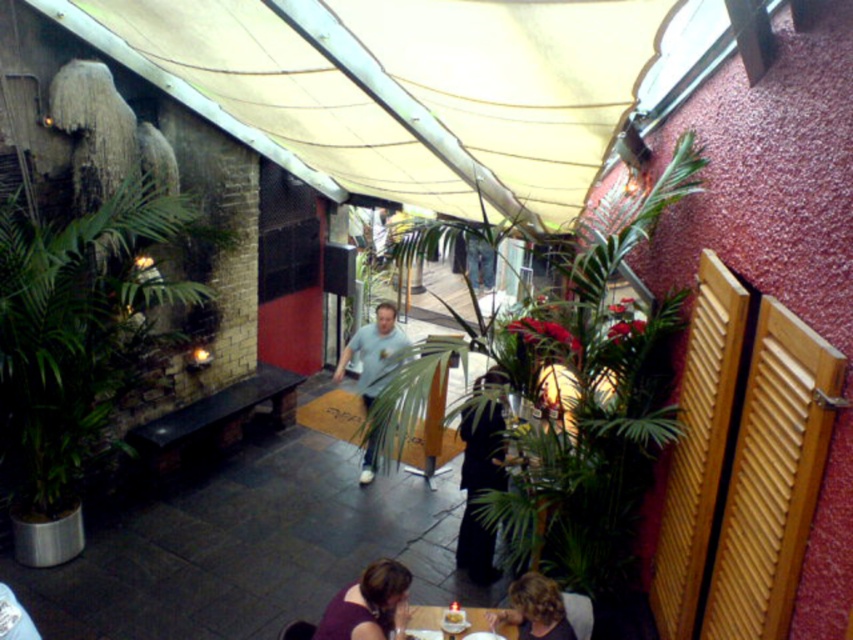
Question: Where is green leafy plant at left located in relation to light blue t-shirt at center in the image?

Choices:
 (A) right
 (B) left

Answer: (B)

Question: Can you confirm if beige fabric canopy at upper center is smaller than green leafy plant at left?

Choices:
 (A) yes
 (B) no

Answer: (B)

Question: Which object is the closest to the light blue t-shirt at center?

Choices:
 (A) beige fabric canopy at upper center
 (B) blonde hair at lower center

Answer: (A)

Question: Which object is farther from the camera taking this photo?

Choices:
 (A) beige fabric canopy at upper center
 (B) smooth wooden table at lower center
 (C) green leafy plant at left
 (D) dark gray coat at center

Answer: (C)

Question: Among these objects, which one is farthest from the camera?

Choices:
 (A) beige fabric canopy at upper center
 (B) blonde hair at lower center

Answer: (B)

Question: Is green leafy plant at left thinner than dark gray coat at center?

Choices:
 (A) yes
 (B) no

Answer: (B)